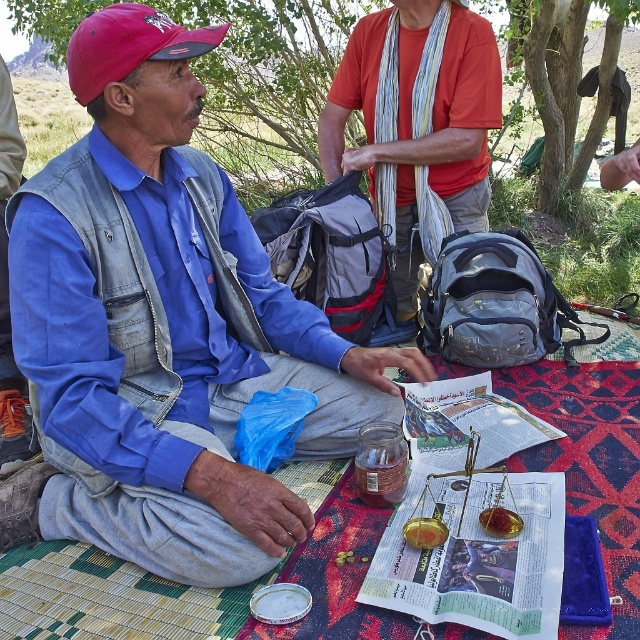
Question: Which point is closer to the camera?

Choices:
 (A) green leafy tree at center
 (B) orange cotton shirt at center
 (C) denim vest at left

Answer: (C)

Question: Does denim vest at left have a greater width compared to green leafy tree at center?

Choices:
 (A) no
 (B) yes

Answer: (B)

Question: Which point appears closest to the camera in this image?

Choices:
 (A) (515, 49)
 (B) (122, 308)

Answer: (B)

Question: Is denim vest at left thinner than orange cotton shirt at center?

Choices:
 (A) yes
 (B) no

Answer: (B)

Question: Among these points, which one is nearest to the camera?

Choices:
 (A) (339, 138)
 (B) (570, 68)
 (C) (132, 106)

Answer: (C)

Question: Observing the image, what is the correct spatial positioning of denim vest at left in reference to orange cotton shirt at center?

Choices:
 (A) below
 (B) above

Answer: (A)